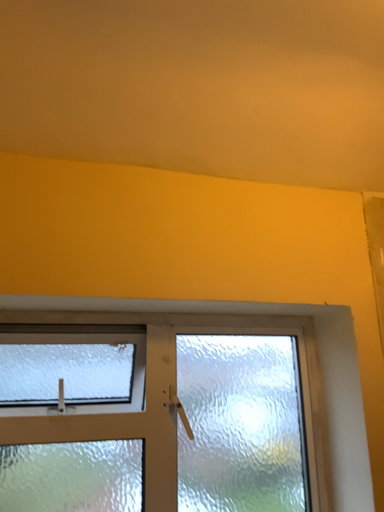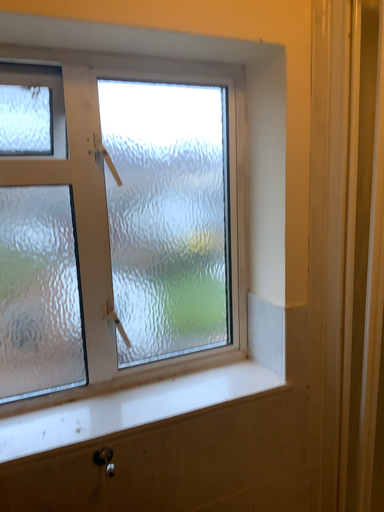
Question: Which way did the camera rotate in the video?

Choices:
 (A) rotated upward
 (B) rotated downward

Answer: (B)